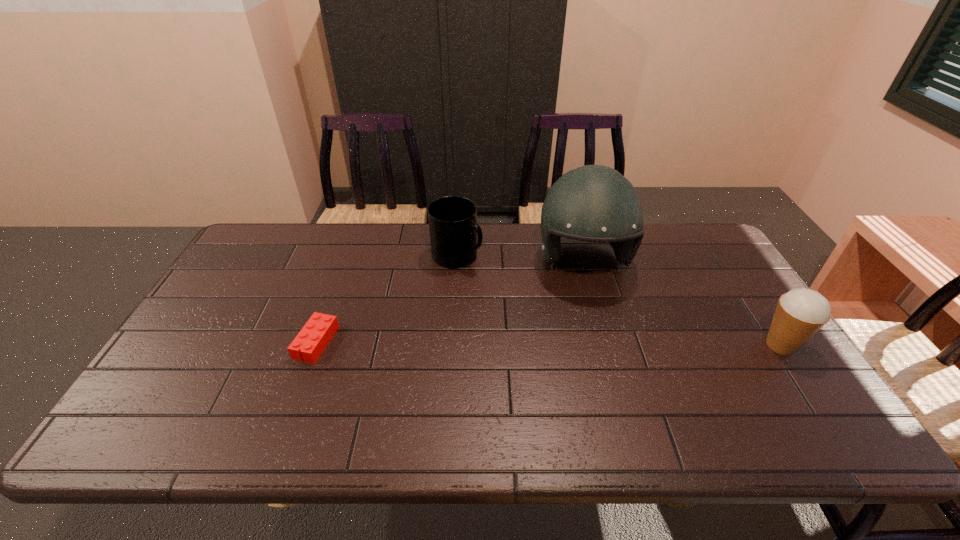
This screenshot has width=960, height=540. What are the coordinates of `free point between the mug and the Lego` in the screenshot? It's located at (387, 299).

What are the coordinates of `the second closest object relative to the leftmost object` in the screenshot? It's located at tap(594, 203).

Where is `object that stands as the second closest to the tallest object`? object that stands as the second closest to the tallest object is located at coordinates (800, 313).

You are a GUI agent. You are given a task and a screenshot of the screen. Output one action in this format:
    pyautogui.click(x=<x>, y=<y>)
    Task: Click on the blank area in the image that satisfies the following two spatial constraints: 1. on the front side of the second object from right to left; 2. on the left side of the icecream
    
    Given the screenshot: What is the action you would take?
    pyautogui.click(x=606, y=345)